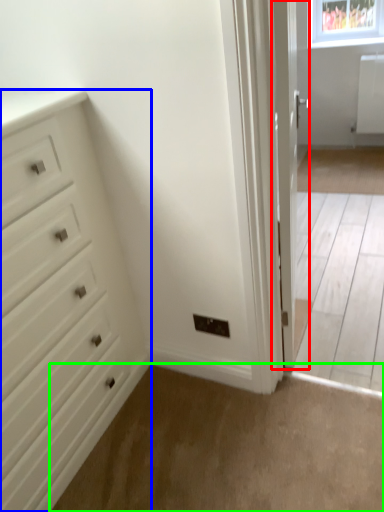
Question: Estimate the real-world distances between objects in this image. Which object is closer to door (highlighted by a red box), chest of drawers (highlighted by a blue box) or plain (highlighted by a green box)?

Choices:
 (A) chest of drawers
 (B) plain

Answer: (B)